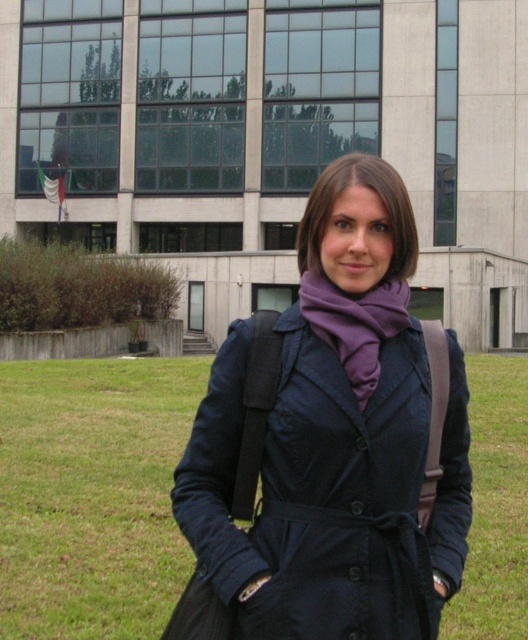
From the picture: You are a fashion designer observing the person dressed in a matte black coat at center and a purple soft scarf at center. Which clothing item would you recommend removing if the person wants to appear more layered and voluminous?

The matte black coat at center is thinner than the purple soft scarf at center, so removing the matte black coat at center would allow the purple soft scarf at center to create a more layered and voluminous look.

You are a fashion designer observing the scene. You need to decide whether both the purple soft scarf at center and the purple matte scarf at center can be displayed on a single mannequin stand that is 7 meters wide. Can they fit without overlapping?

The purple soft scarf at center and purple matte scarf at center are 7.33 meters apart from each other. Since the mannequin stand is only 7 meters wide, the distance between them exceeds the stand width, so they cannot fit without overlapping.

You are a tailor measuring the distance between the matte black coat at center and the purple soft scarf at center for a custom fit. Given that the minimum required space for proper adjustment is 14 inches, is the current distance sufficient?

The distance between the matte black coat at center and the purple soft scarf at center is 13.95 inches, which is just below the required 14 inches. Therefore, the current distance is insufficient for the proper adjustment.